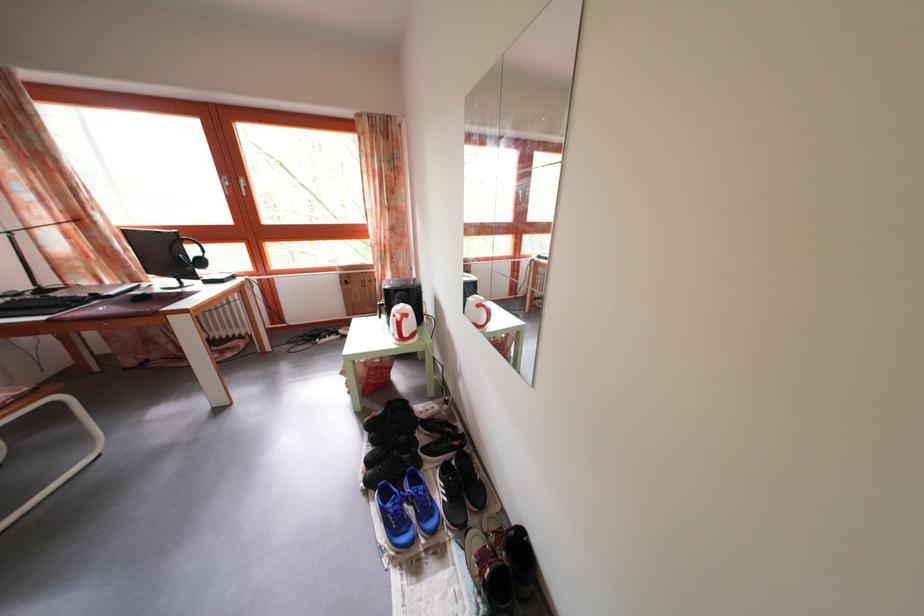
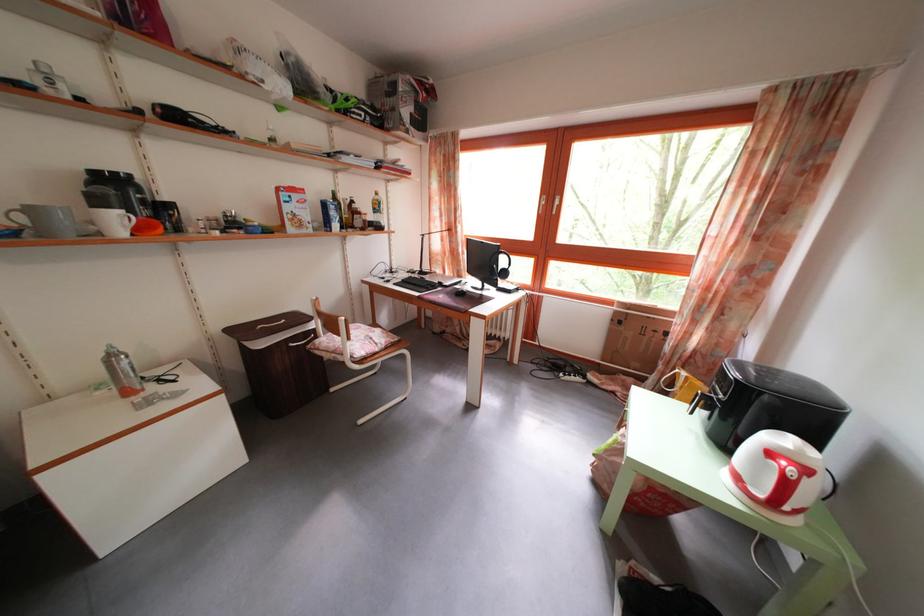
Where in the second image is the point corresponding to pixel 414 323 from the first image?

(812, 477)